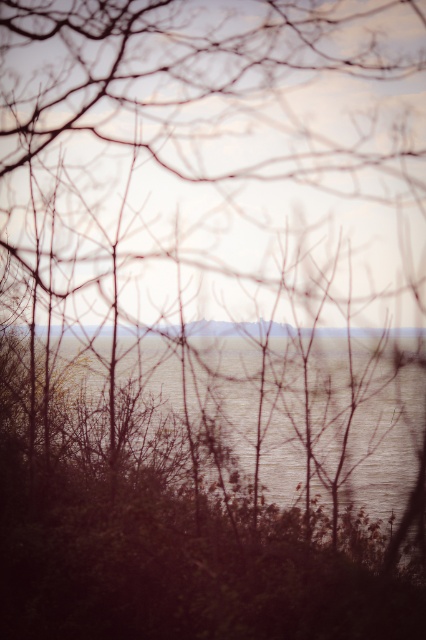
Which is more to the right, silvery reflective water at center or smooth water at center?

smooth water at center is more to the right.

In the scene shown: Does silvery reflective water at center have a larger size compared to smooth water at center?

Yes, silvery reflective water at center is bigger than smooth water at center.

What do you see at coordinates (172, 465) in the screenshot? This screenshot has height=640, width=426. I see `silvery reflective water at center` at bounding box center [172, 465].

Identify the location of silvery reflective water at center. (172, 465).